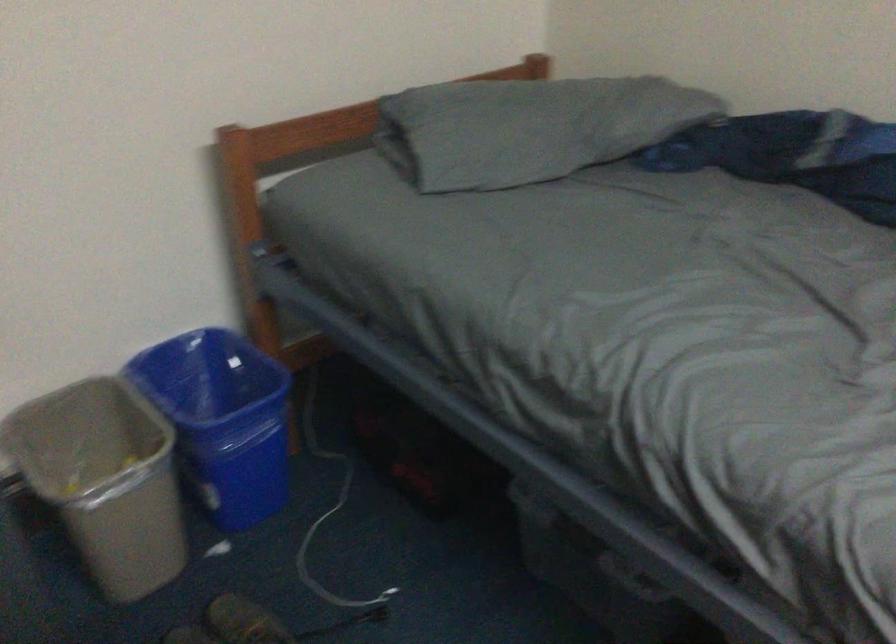
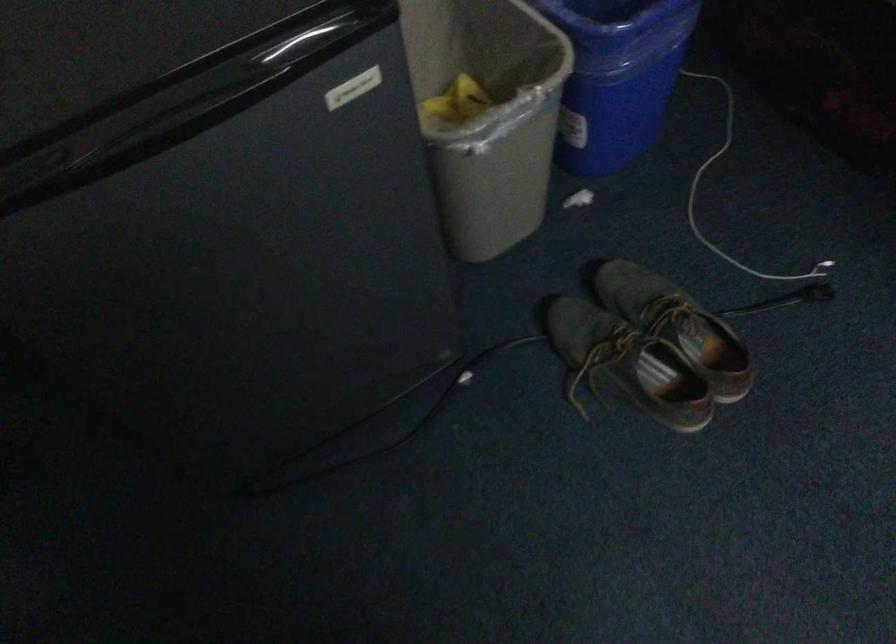
Question: Based on the continuous images, in which direction is the camera rotating? Reply with the corresponding letter.

Choices:
 (A) Left
 (B) Right
 (C) Up
 (D) Down

Answer: (D)